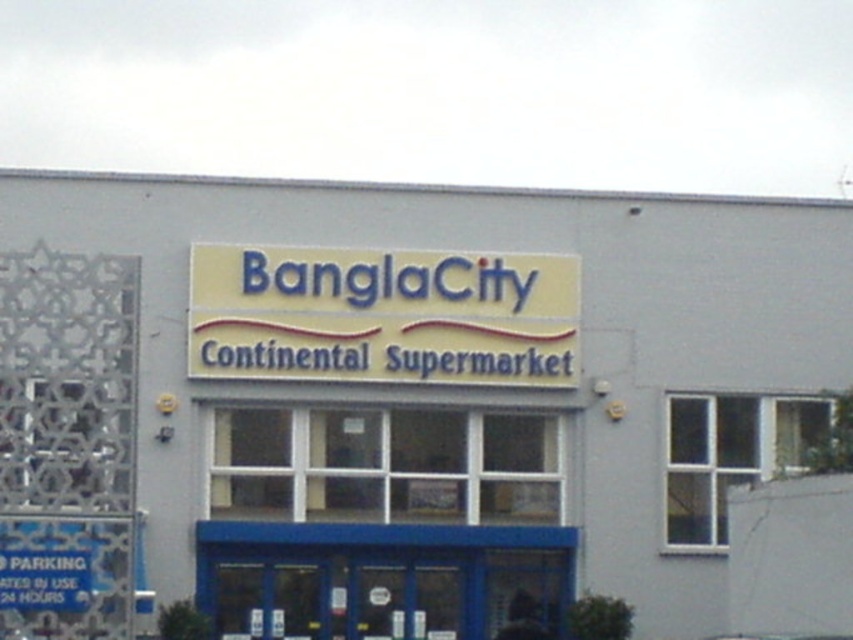
Question: Is white matte sign at center to the left of yellow matte sign at center from the viewer's perspective?

Choices:
 (A) no
 (B) yes

Answer: (A)

Question: From the image, what is the correct spatial relationship of white matte sign at center in relation to yellow matte sign at center?

Choices:
 (A) right
 (B) left

Answer: (A)

Question: Which of the following is the closest to the observer?

Choices:
 (A) (476, 612)
 (B) (358, 330)

Answer: (B)

Question: Can you confirm if white matte sign at center is bigger than yellow matte sign at center?

Choices:
 (A) no
 (B) yes

Answer: (B)